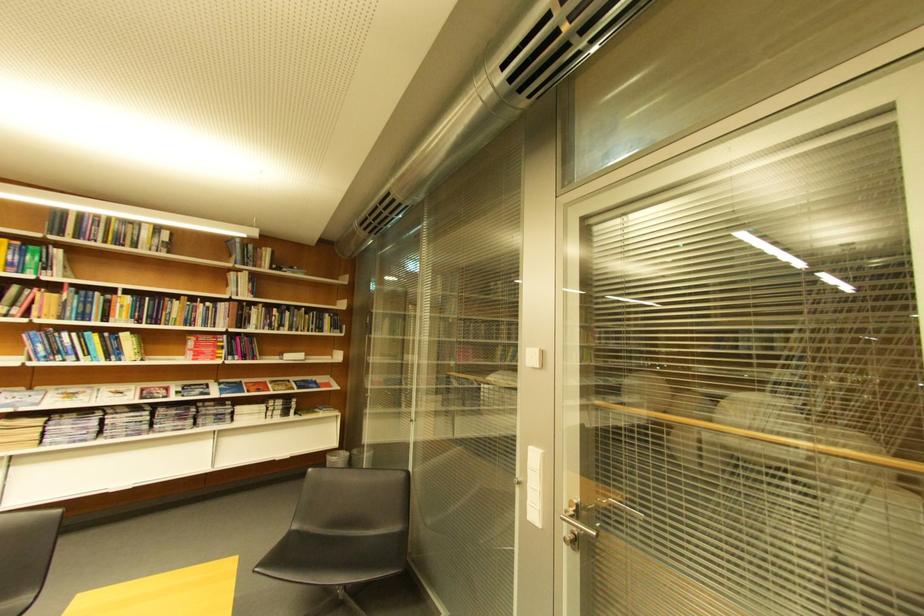
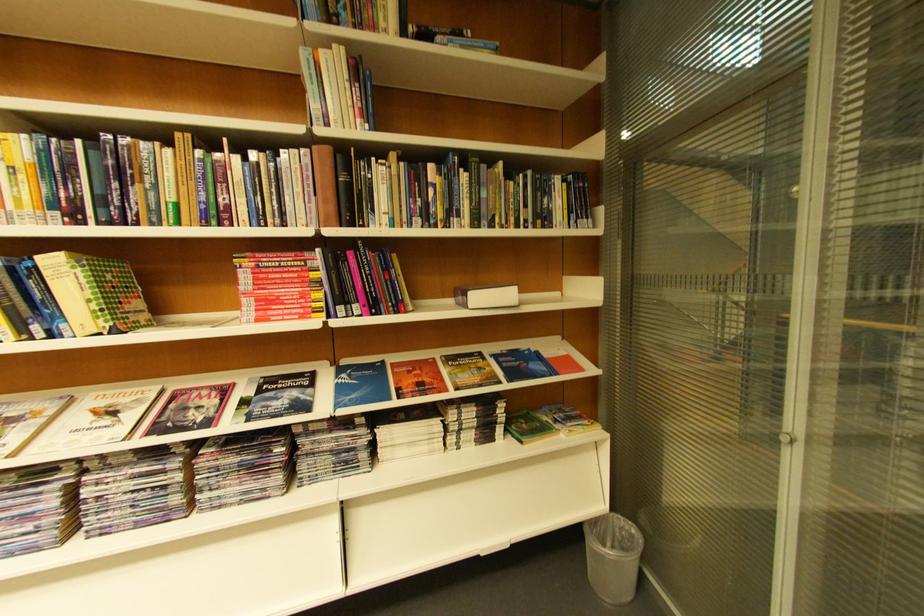
In the second image, find the point that corresponds to point 250,275 in the first image.

(332, 55)